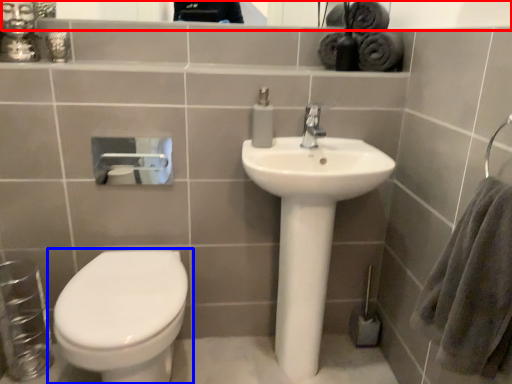
Question: Which object is further to the camera taking this photo, mirror (highlighted by a red box) or toilet (highlighted by a blue box)?

Choices:
 (A) mirror
 (B) toilet

Answer: (A)